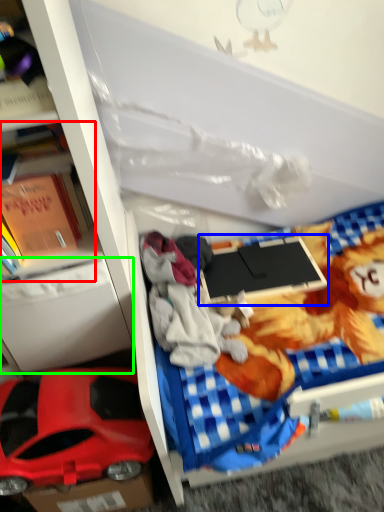
Question: Which object is positioned farthest from book (highlighted by a red box)? Select from laptop (highlighted by a blue box) and drawer (highlighted by a green box).

Choices:
 (A) laptop
 (B) drawer

Answer: (A)